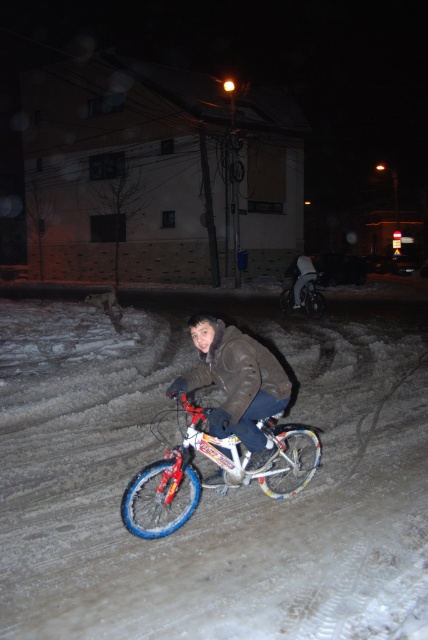
From the picture: You are a delivery person who needs to deliver a package to the address located at the multi story building with a beige facade. You see the white powdery snow at center and the brown fuzzy jacket at center. Which object is closer to the delivery location?

The white powdery snow at center is located below the brown fuzzy jacket at center, so the brown fuzzy jacket at center is closer to the delivery location since it is above the snow which is on the ground.

You are standing in the snow and see two points in the image. One is at point (202,355) and the other is at point (309,308). Which point is closer to you?

Point (202,355) is closer to you than point (309,308).

You are a delivery person who needs to park your metallic silver bicycle at center near the building in the background. Based on the scene description, can you determine if there is enough space between the bicycle and the building to park safely?

The metallic silver bicycle at center is located at point (312, 300), so there is enough space between the bicycle and the building to park safely.